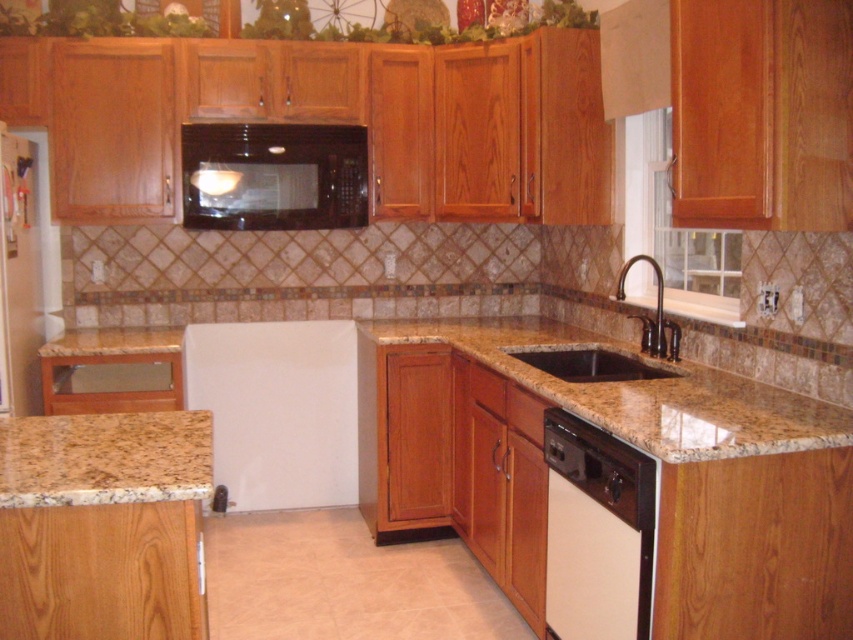
You are a chef preparing to place a large cutting board on the granite countertop at lower left. The board requires at least 6 feet of space. Can you fit it there?

Answer: The granite countertop at lower left has a space of 6.01 feet, which is just enough to accommodate the cutting board requiring 6 feet of space.